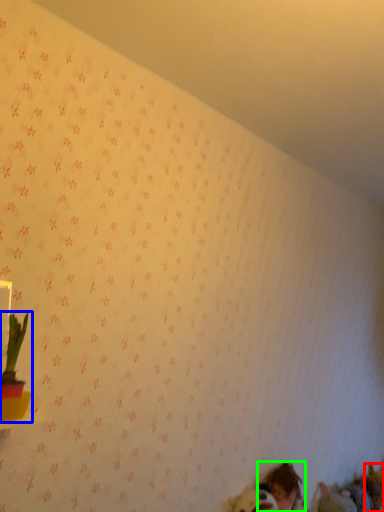
Question: Estimate the real-world distances between objects in this image. Which object is closer to animal (highlighted by a red box), houseplant (highlighted by a blue box) or person (highlighted by a green box)?

Choices:
 (A) houseplant
 (B) person

Answer: (B)